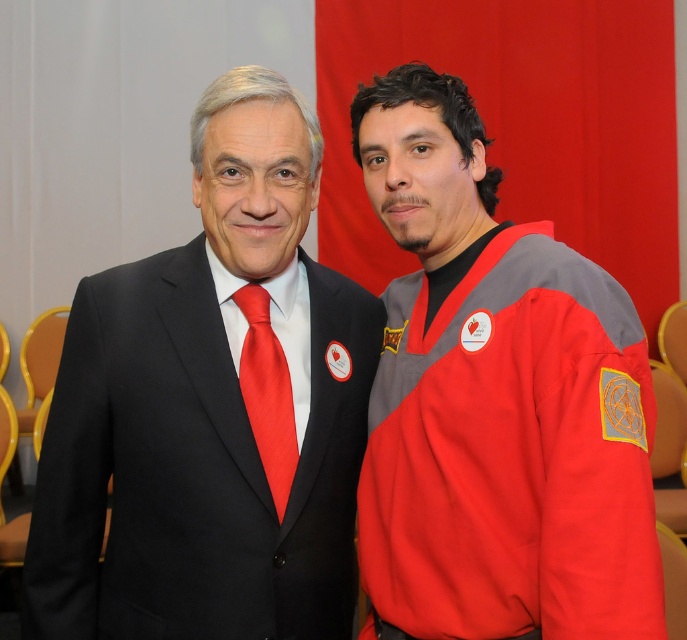
You are a photographer setting up for a group photo. You need to ensure that the matte red hockey jersey at right and the shiny silk tie at center are both visible in the frame. Given their sizes, which object should be placed closer to the camera to maintain visibility?

The shiny silk tie at center should be placed closer to the camera because the matte red hockey jersey at right is much taller, so positioning the smaller shiny silk tie at center nearer ensures both are visible in the frame.